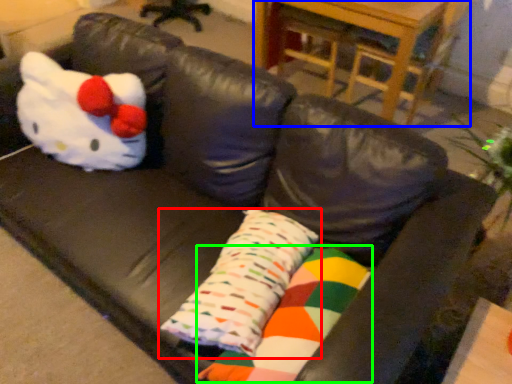
Question: Which object is positioned farthest from pillow (highlighted by a red box)? Select from table (highlighted by a blue box) and material (highlighted by a green box).

Choices:
 (A) table
 (B) material

Answer: (A)